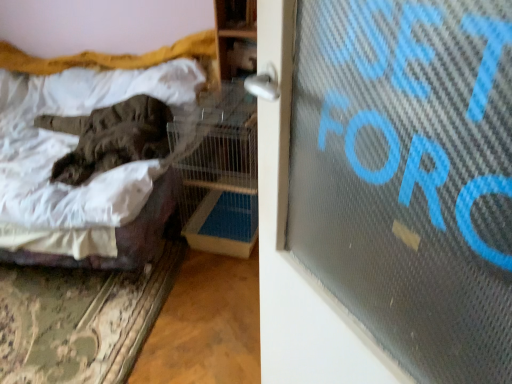
Question: Does velvet brown blanket at left have a greater width compared to dark gray fur cat at left?

Choices:
 (A) yes
 (B) no

Answer: (A)

Question: Considering the relative sizes of velvet brown blanket at left and dark gray fur cat at left in the image provided, is velvet brown blanket at left thinner than dark gray fur cat at left?

Choices:
 (A) yes
 (B) no

Answer: (B)

Question: Does velvet brown blanket at left have a lesser height compared to dark gray fur cat at left?

Choices:
 (A) no
 (B) yes

Answer: (A)

Question: Are velvet brown blanket at left and dark gray fur cat at left located far from each other?

Choices:
 (A) yes
 (B) no

Answer: (B)

Question: From the image's perspective, is velvet brown blanket at left over dark gray fur cat at left?

Choices:
 (A) yes
 (B) no

Answer: (B)

Question: Is velvet brown blanket at left smaller than dark gray fur cat at left?

Choices:
 (A) yes
 (B) no

Answer: (B)

Question: Is dark gray fur cat at left positioned in front of velvet brown blanket at left?

Choices:
 (A) yes
 (B) no

Answer: (B)

Question: Is dark gray fur cat at left smaller than velvet brown blanket at left?

Choices:
 (A) no
 (B) yes

Answer: (B)

Question: Does dark gray fur cat at left have a lesser width compared to velvet brown blanket at left?

Choices:
 (A) yes
 (B) no

Answer: (A)

Question: Considering the relative sizes of dark gray fur cat at left and velvet brown blanket at left in the image provided, is dark gray fur cat at left wider than velvet brown blanket at left?

Choices:
 (A) no
 (B) yes

Answer: (A)

Question: Considering the relative sizes of dark gray fur cat at left and velvet brown blanket at left in the image provided, is dark gray fur cat at left shorter than velvet brown blanket at left?

Choices:
 (A) no
 (B) yes

Answer: (B)

Question: From the image's perspective, is dark gray fur cat at left located beneath velvet brown blanket at left?

Choices:
 (A) yes
 (B) no

Answer: (B)

Question: In terms of size, does dark gray fur cat at left appear bigger or smaller than velvet brown blanket at left?

Choices:
 (A) small
 (B) big

Answer: (A)